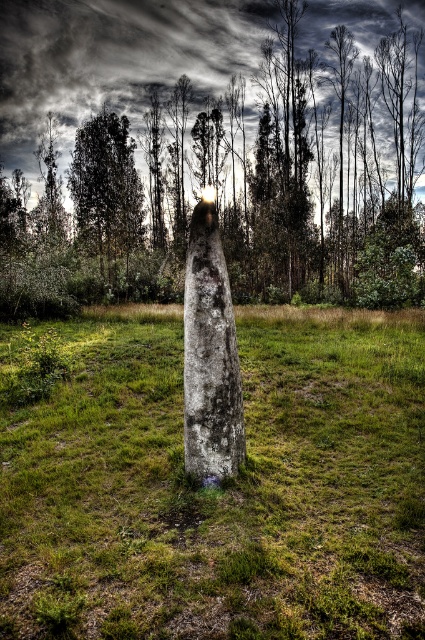
Question: Can you confirm if smooth gray stone at center is positioned to the left of gray weathered stone at center?

Choices:
 (A) yes
 (B) no

Answer: (A)

Question: Is smooth gray stone at center in front of gray weathered stone at center?

Choices:
 (A) yes
 (B) no

Answer: (B)

Question: Estimate the real-world distances between objects in this image. Which object is farther from the smooth gray stone at center?

Choices:
 (A) gray weathered stone at center
 (B) white stone pillar at center

Answer: (A)

Question: Which object appears farthest from the camera in this image?

Choices:
 (A) gray weathered stone at center
 (B) smooth gray stone at center

Answer: (B)

Question: Where is smooth gray stone at center located in relation to gray weathered stone at center in the image?

Choices:
 (A) left
 (B) right

Answer: (A)

Question: Among these points, which one is farthest from the camera?

Choices:
 (A) (206, 88)
 (B) (108, 588)

Answer: (A)